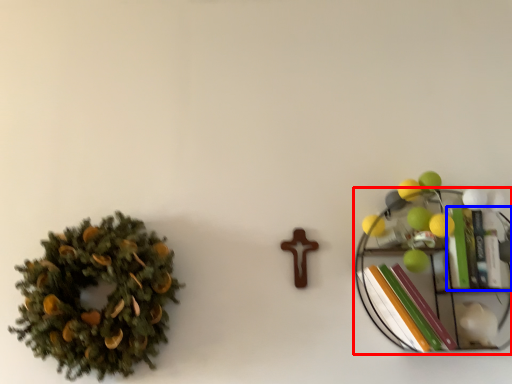
Question: Which of the following is the farthest to the observer, shelf (highlighted by a red box) or book (highlighted by a blue box)?

Choices:
 (A) shelf
 (B) book

Answer: (B)